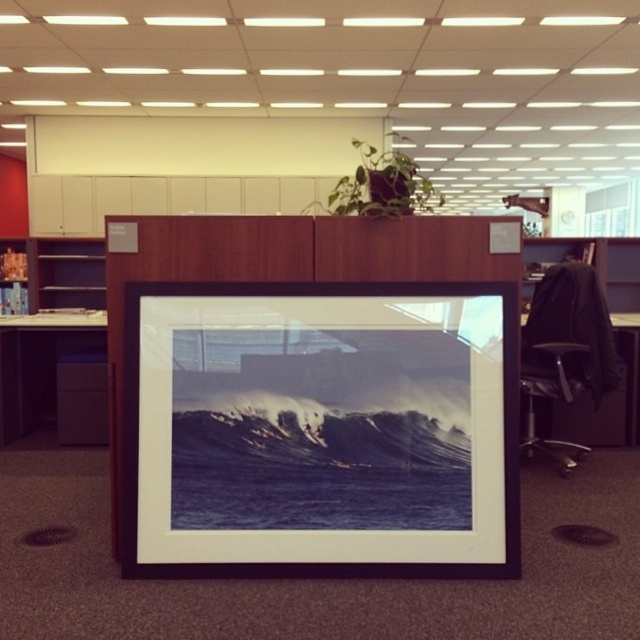
Question: Which object appears farthest from the camera in this image?

Choices:
 (A) black matte picture frame at center
 (B) matte black table at lower left

Answer: (B)

Question: Which point is closer to the camera?

Choices:
 (A) matte black table at lower left
 (B) black leather table at right

Answer: (B)

Question: Is black matte picture frame at center wider than matte black table at lower left?

Choices:
 (A) yes
 (B) no

Answer: (A)

Question: Does black matte picture frame at center lie behind matte black table at lower left?

Choices:
 (A) no
 (B) yes

Answer: (A)

Question: Considering the real-world distances, which object is farthest from the black leather table at right?

Choices:
 (A) matte black table at lower left
 (B) black matte picture frame at center

Answer: (A)

Question: Does matte black table at lower left appear on the right side of black leather table at right?

Choices:
 (A) yes
 (B) no

Answer: (B)